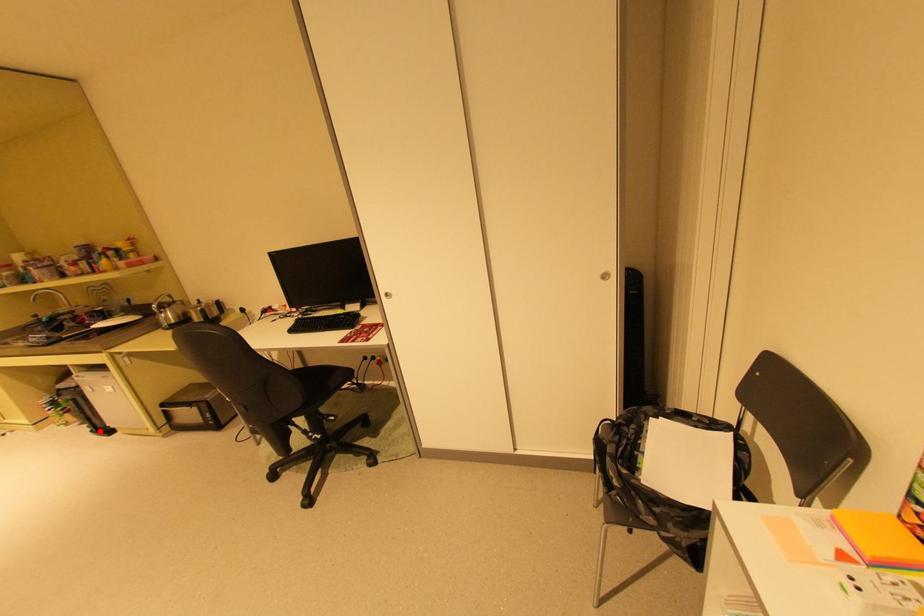
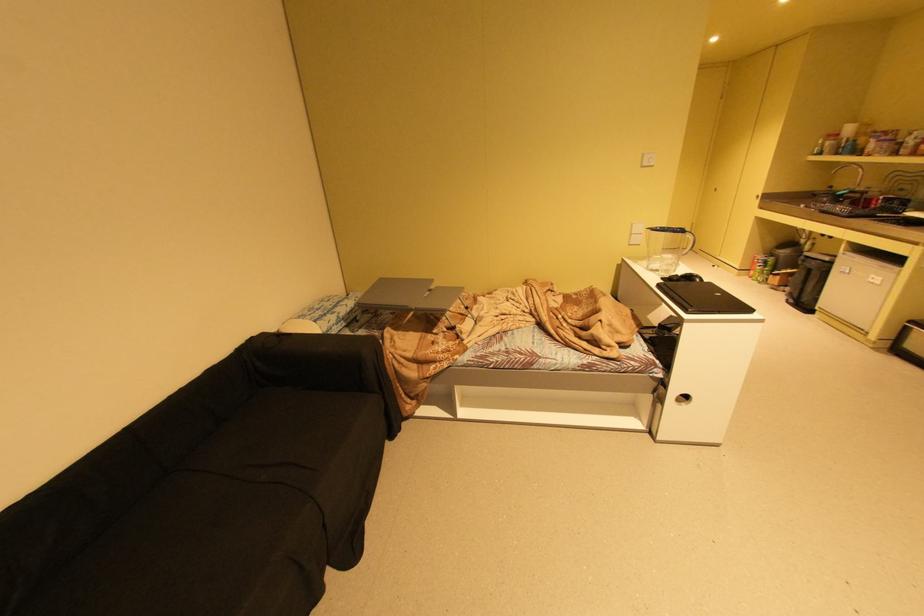
Find the pixel in the second image that matches the highlighted location in the first image.

(796, 301)